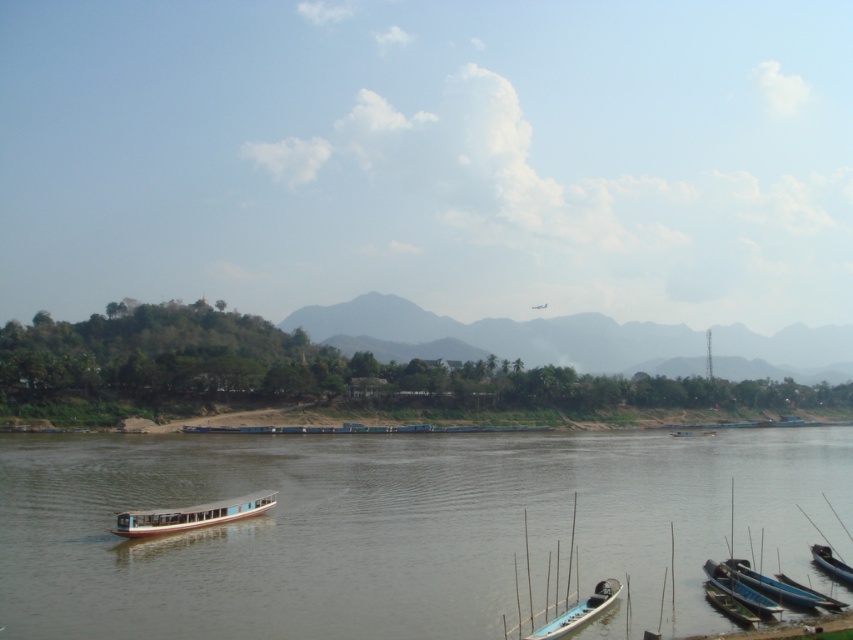
Question: Which point is farther to the camera?

Choices:
 (A) wooden polished boat at center
 (B) black glossy boat at lower right

Answer: (A)

Question: Is blue polished wood canoe at lower right smaller than green wooden canoe at lower right?

Choices:
 (A) no
 (B) yes

Answer: (B)

Question: Considering the real-world distances, which object is closest to the blue polished wood canoe at lower right?

Choices:
 (A) black glossy boat at lower right
 (B) green wooden canoe at lower right
 (C) wooden polished boat at center
 (D) light blue plastic canoe at lower right

Answer: (B)

Question: Is blue polished wood canoe at lower right below black glossy boat at lower right?

Choices:
 (A) yes
 (B) no

Answer: (B)

Question: From the image, what is the correct spatial relationship of light blue plastic canoe at lower right in relation to black glossy boat at lower right?

Choices:
 (A) left
 (B) right

Answer: (A)

Question: Which of the following is the closest to the observer?

Choices:
 (A) (432, 534)
 (B) (838, 580)

Answer: (B)